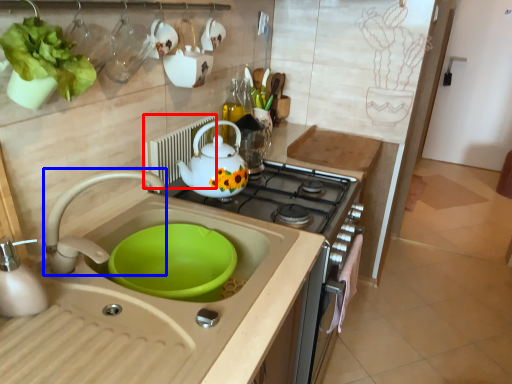
Question: Which object is closer to the camera taking this photo, appliance (highlighted by a red box) or tap (highlighted by a blue box)?

Choices:
 (A) appliance
 (B) tap

Answer: (B)